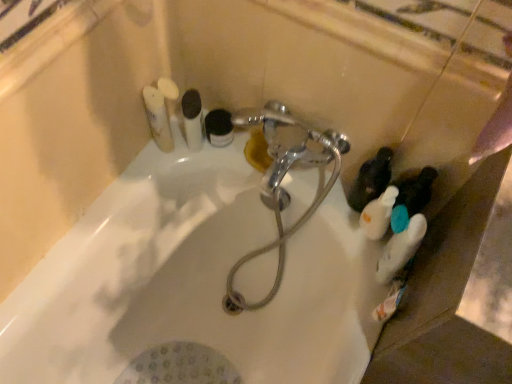
This screenshot has height=384, width=512. Find the location of `free point to the right of white glossy tube at upper center, the fourth toiletry from the right`. free point to the right of white glossy tube at upper center, the fourth toiletry from the right is located at coordinates (253, 161).